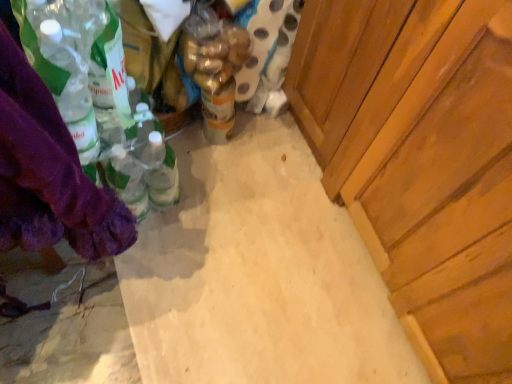
Locate an element on the screen. The image size is (512, 384). yellow matte can at center is located at coordinates (219, 113).

Is wooden cabinet at right turned away from yellow matte can at center?

No, wooden cabinet at right is not facing away from yellow matte can at center.

Is wooden cabinet at right located outside yellow matte can at center?

Indeed, wooden cabinet at right is completely outside yellow matte can at center.

Considering the relative sizes of wooden cabinet at right and yellow matte can at center in the image provided, is wooden cabinet at right bigger than yellow matte can at center?

Correct, wooden cabinet at right is larger in size than yellow matte can at center.

Between wooden cabinet at right and yellow matte can at center, which one appears on the left side from the viewer's perspective?

From the viewer's perspective, yellow matte can at center appears more on the left side.

Is translucent plastic bottle at center not near wooden cabinet at right?

Actually, translucent plastic bottle at center and wooden cabinet at right are a little close together.

Would you say translucent plastic bottle at center is to the left or to the right of wooden cabinet at right in the picture?

In the image, translucent plastic bottle at center appears on the left side of wooden cabinet at right.

From a real-world perspective, who is located lower, translucent plastic bottle at center or wooden cabinet at right?

In real-world perspective, translucent plastic bottle at center is lower.

From the image's perspective, is translucent plastic bottle at center positioned above or below wooden cabinet at right?

translucent plastic bottle at center is situated higher than wooden cabinet at right in the image.

From the image's perspective, would you say yellow matte can at center is positioned over translucent plastic bottle at center?

Actually, yellow matte can at center appears below translucent plastic bottle at center in the image.

Considering the positions of objects yellow matte can at center and translucent plastic bottle at center in the image provided, who is more to the left, yellow matte can at center or translucent plastic bottle at center?

yellow matte can at center.

Measure the distance from yellow matte can at center to translucent plastic bottle at center.

The distance of yellow matte can at center from translucent plastic bottle at center is 2.11 inches.

In the scene shown: Which is farther from the camera, (x=221, y=110) or (x=194, y=18)?

The point (x=221, y=110) is behind.

Does translucent plastic bottle at center have a greater height compared to yellow matte can at center?

Indeed, translucent plastic bottle at center has a greater height compared to yellow matte can at center.

Which object is further away from the camera, translucent plastic bottle at center or yellow matte can at center?

yellow matte can at center is further from the camera.

From a real-world perspective, is translucent plastic bottle at center physically located above or below yellow matte can at center?

Clearly, from a real-world perspective, translucent plastic bottle at center is above yellow matte can at center.

From the image's perspective, would you say purple fabric at left is shown under translucent plastic bottle at center?

Indeed, from the image's perspective, purple fabric at left is shown beneath translucent plastic bottle at center.

How distant is purple fabric at left from translucent plastic bottle at center?

The distance of purple fabric at left from translucent plastic bottle at center is 24.10 inches.

Is translucent plastic bottle at center completely or partially inside purple fabric at left?

No.

Is point (98, 237) closer to camera compared to point (244, 32)?

That is True.

In the scene shown: From the image's perspective, would you say translucent plastic bottle at center is shown under purple fabric at left?

No, from the image's perspective, translucent plastic bottle at center is not below purple fabric at left.

Who is bigger, translucent plastic bottle at center or purple fabric at left?

purple fabric at left.

This screenshot has height=384, width=512. I want to click on clothing above the translucent plastic bottle at center (from a real-world perspective), so click(x=48, y=173).

In the image, is translucent plastic bottle at center on the left side or the right side of purple fabric at left?

From the image, it's evident that translucent plastic bottle at center is to the right of purple fabric at left.

From the image's perspective, which is below, purple fabric at left or yellow matte can at center?

purple fabric at left, from the image's perspective.

Between purple fabric at left and yellow matte can at center, which one has smaller width?

Thinner between the two is yellow matte can at center.

Is purple fabric at left inside or outside of yellow matte can at center?

purple fabric at left is not inside yellow matte can at center, it's outside.

Considering the sizes of purple fabric at left and yellow matte can at center in the image, is purple fabric at left taller or shorter than yellow matte can at center?

Clearly, purple fabric at left is taller compared to yellow matte can at center.

The image size is (512, 384). Find the location of `cabinetry in front of the yellow matte can at center`. cabinetry in front of the yellow matte can at center is located at coordinates (424, 167).

Locate an element on the screen. The width and height of the screenshot is (512, 384). bottle to the left of wooden cabinet at right is located at coordinates (214, 66).

When comparing their distances from wooden cabinet at right, does yellow matte can at center or purple fabric at left seem closer?

The object closer to wooden cabinet at right is yellow matte can at center.

From the image, which object appears to be nearer to yellow matte can at center, translucent plastic bottle at center or purple fabric at left?

Based on the image, translucent plastic bottle at center appears to be nearer to yellow matte can at center.

Looking at the image, which one is located closer to purple fabric at left, translucent plastic bottle at center or yellow matte can at center?

translucent plastic bottle at center.

Estimate the real-world distances between objects in this image. Which object is closer to purple fabric at left, yellow matte can at center or wooden cabinet at right?

yellow matte can at center.

When comparing their distances from purple fabric at left, does wooden cabinet at right or yellow matte can at center seem further?

wooden cabinet at right lies further to purple fabric at left than the other object.

When comparing their distances from wooden cabinet at right, does translucent plastic bottle at center or yellow matte can at center seem further?

yellow matte can at center lies further to wooden cabinet at right than the other object.

Considering their positions, is purple fabric at left positioned closer to translucent plastic bottle at center than yellow matte can at center?

Among the two, yellow matte can at center is located nearer to translucent plastic bottle at center.

Estimate the real-world distances between objects in this image. Which object is further from translucent plastic bottle at center, yellow matte can at center or purple fabric at left?

Among the two, purple fabric at left is located further to translucent plastic bottle at center.

At what (x,y) coordinates should I click in order to perform the action: click on bottle between purple fabric at left and yellow matte can at center in the front-back direction. Please return your answer as a coordinate pair (x, y). This screenshot has height=384, width=512. Looking at the image, I should click on (214, 66).

Where is `bottle between wooden cabinet at right and yellow matte can at center from front to back`? bottle between wooden cabinet at right and yellow matte can at center from front to back is located at coordinates (214, 66).

Locate an element on the screen. beverage between purple fabric at left and wooden cabinet at right from left to right is located at coordinates (219, 113).

Where is `bottle between purple fabric at left and wooden cabinet at right from left to right`? The height and width of the screenshot is (384, 512). bottle between purple fabric at left and wooden cabinet at right from left to right is located at coordinates (214, 66).